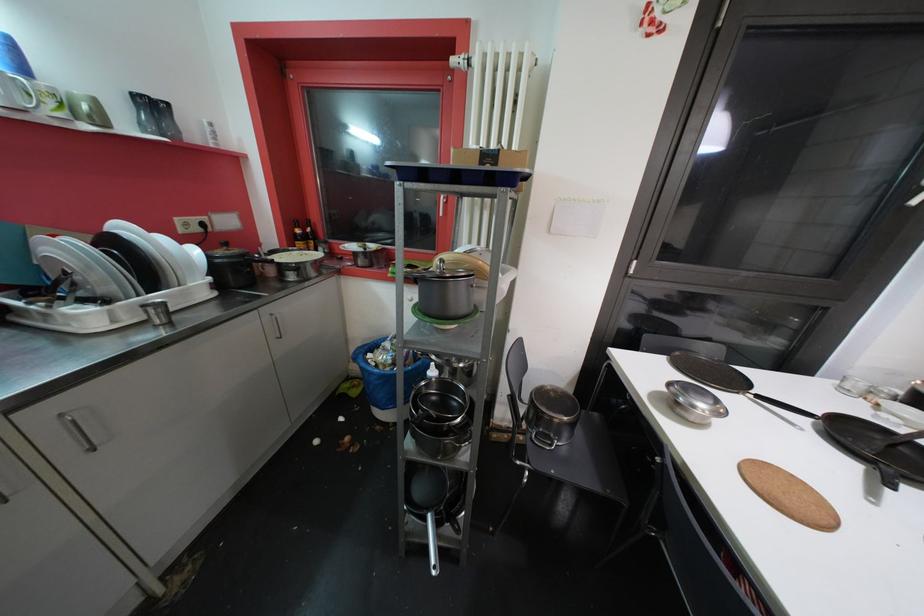
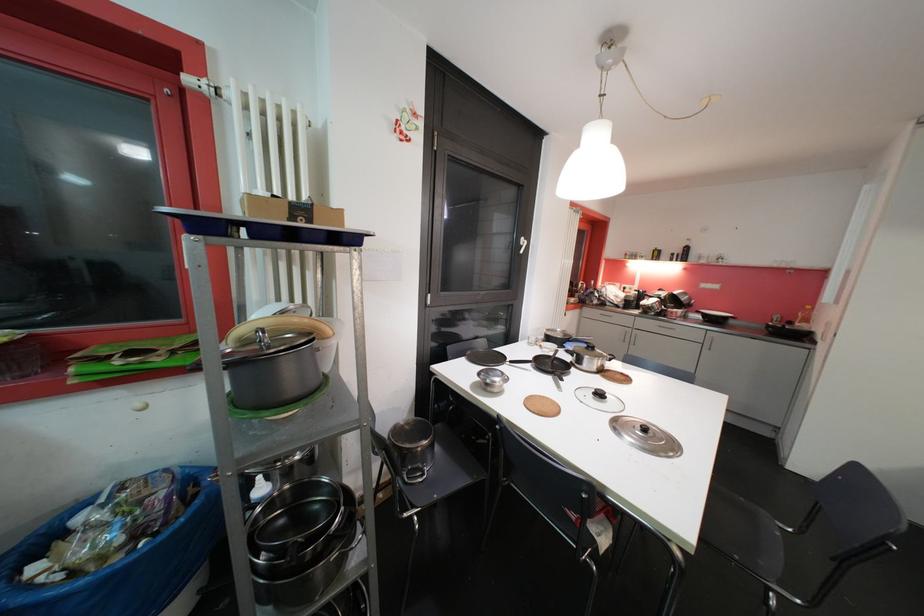
In the second image, find the point that corresponds to pixel 684 413 in the first image.

(493, 392)